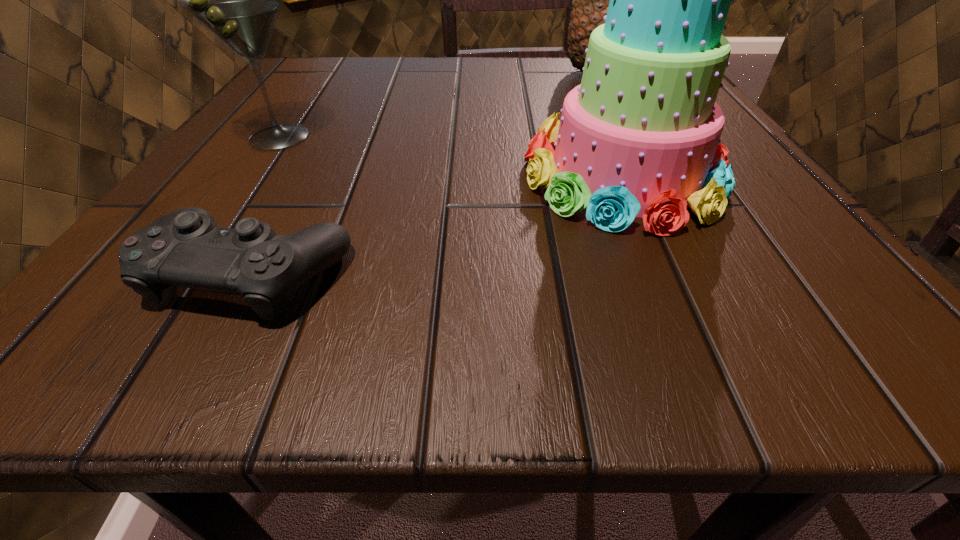
Identify the location of object at the near edge. This screenshot has height=540, width=960. (186, 248).

What are the coordinates of `martini that is at the left edge` in the screenshot? It's located at (238, 0).

Identify the location of control that is at the left edge. pyautogui.click(x=186, y=248).

Where is `pineapple present at the right edge`? This screenshot has height=540, width=960. pineapple present at the right edge is located at coordinates (590, 3).

This screenshot has width=960, height=540. I want to click on cake that is at the right edge, so click(x=640, y=136).

This screenshot has height=540, width=960. I want to click on object at the near left corner, so click(x=186, y=248).

The height and width of the screenshot is (540, 960). Find the location of `object at the far right corner`. object at the far right corner is located at coordinates (590, 3).

This screenshot has height=540, width=960. I want to click on free space at the far edge, so tap(392, 91).

In the image, there is a desktop. What are the coordinates of `vacant space at the near edge` in the screenshot? It's located at (672, 329).

Identify the location of free space at the left edge. The height and width of the screenshot is (540, 960). (314, 109).